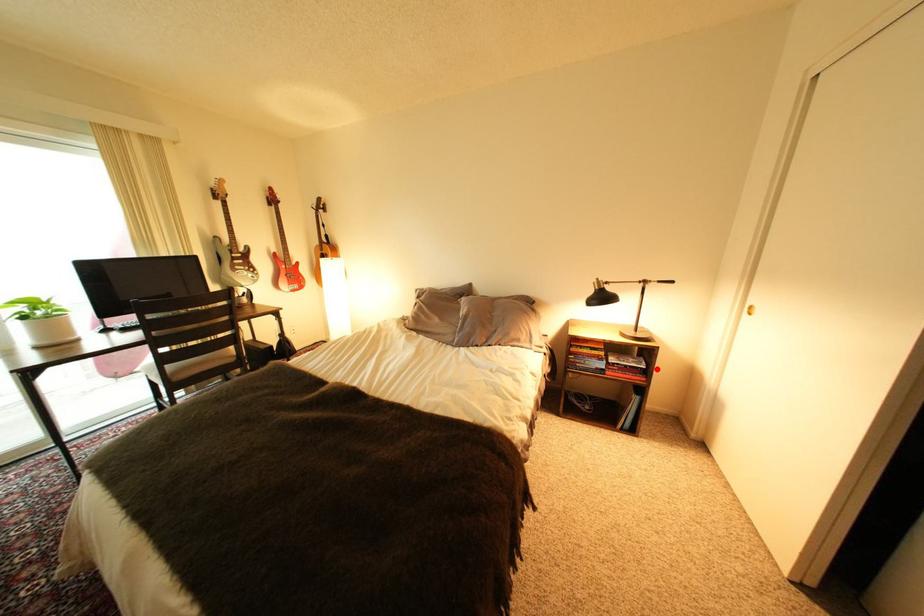
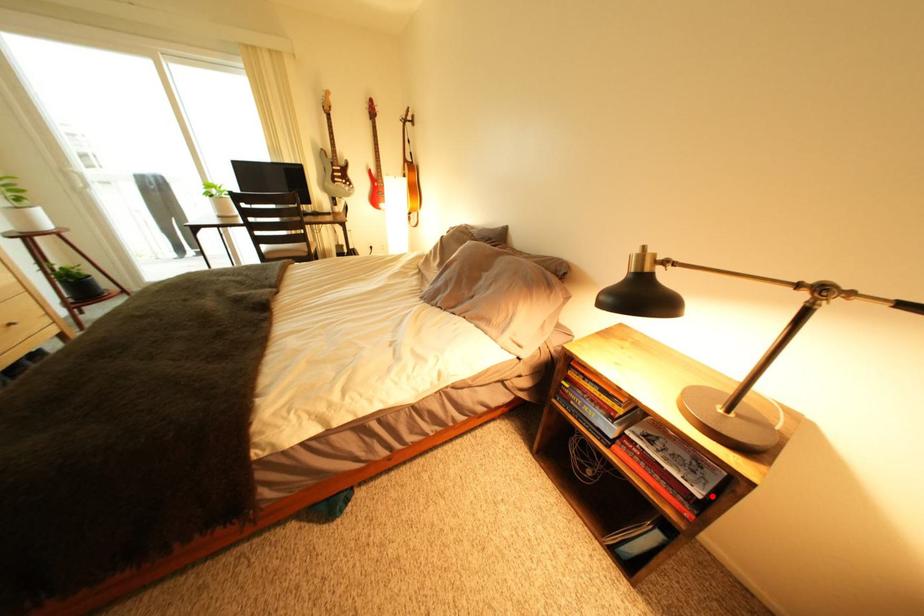
I am providing you with two images of the same scene from different viewpoints. A red point is marked on the first image and another point is marked on the second image. Does the point marked in image1 correspond to the same location as the one in image2?

Yes